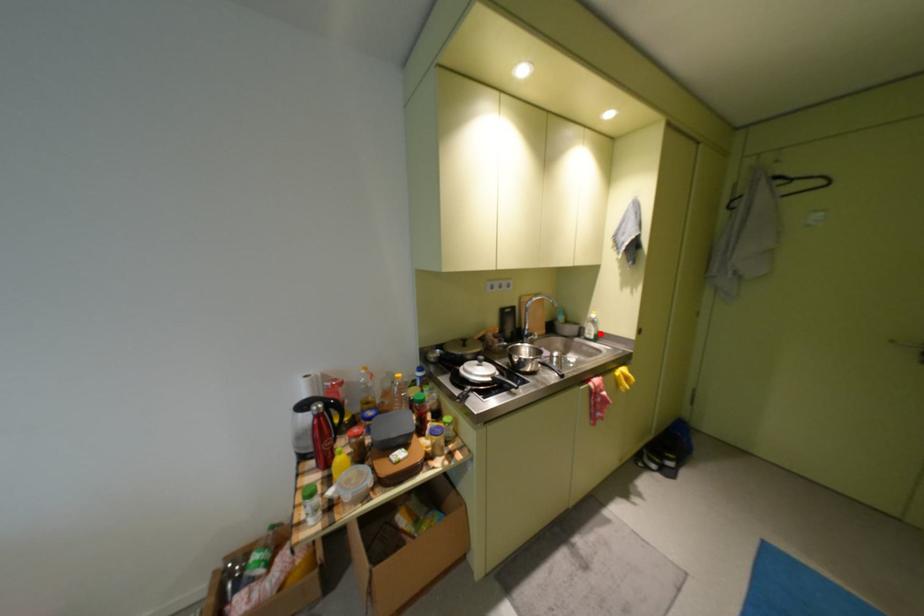
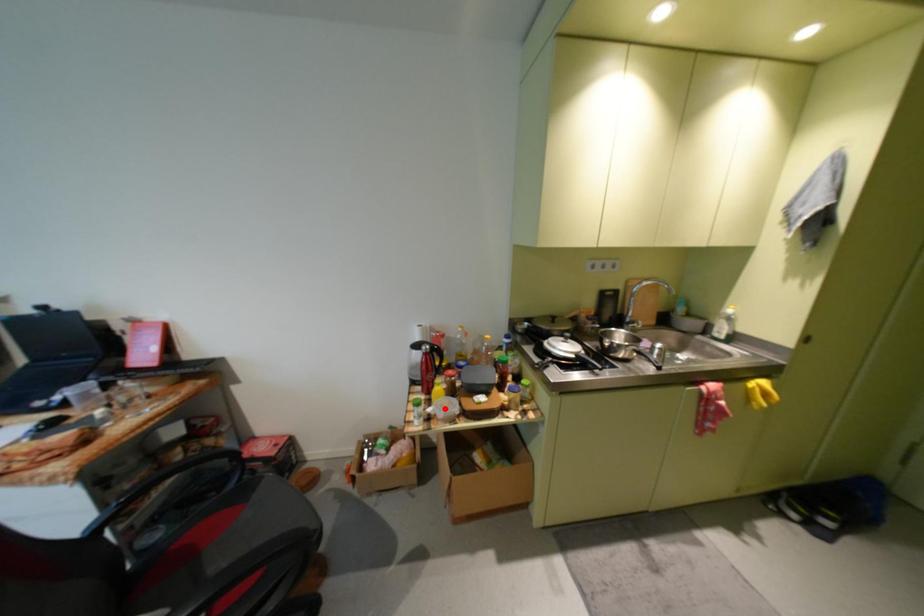
I am providing you with two images of the same scene from different viewpoints. A red point is marked on the first image and another point is marked on the second image. Are the points marked in image1 and image2 representing the same 3D position?

No